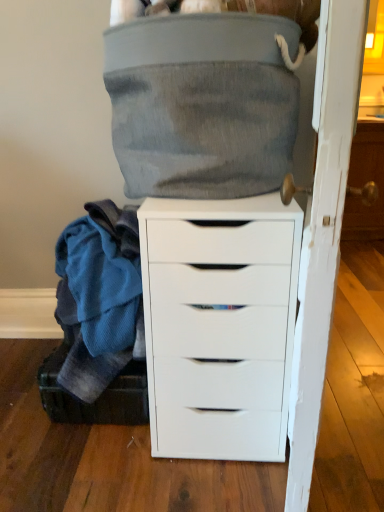
Question: From a real-world perspective, is white matte chest of drawers at center physically above black fabric shoe box at lower left?

Choices:
 (A) no
 (B) yes

Answer: (B)

Question: From the image's perspective, is white matte chest of drawers at center on black fabric shoe box at lower left?

Choices:
 (A) yes
 (B) no

Answer: (A)

Question: Is white matte chest of drawers at center turned away from black fabric shoe box at lower left?

Choices:
 (A) no
 (B) yes

Answer: (A)

Question: Is white matte chest of drawers at center positioned beyond the bounds of black fabric shoe box at lower left?

Choices:
 (A) yes
 (B) no

Answer: (A)

Question: From the image's perspective, is white matte chest of drawers at center located beneath black fabric shoe box at lower left?

Choices:
 (A) yes
 (B) no

Answer: (B)

Question: From the image's perspective, is white wood door at right above or below black fabric shoe box at lower left?

Choices:
 (A) below
 (B) above

Answer: (B)

Question: From their relative heights in the image, would you say white wood door at right is taller or shorter than black fabric shoe box at lower left?

Choices:
 (A) short
 (B) tall

Answer: (B)

Question: Based on their positions, is white wood door at right located to the left or right of black fabric shoe box at lower left?

Choices:
 (A) right
 (B) left

Answer: (A)

Question: In terms of size, does white wood door at right appear bigger or smaller than black fabric shoe box at lower left?

Choices:
 (A) small
 (B) big

Answer: (B)

Question: From their relative heights in the image, would you say white matte chest of drawers at center is taller or shorter than black fabric shoe box at lower left?

Choices:
 (A) short
 (B) tall

Answer: (B)

Question: In the image, is white matte chest of drawers at center on the left side or the right side of black fabric shoe box at lower left?

Choices:
 (A) left
 (B) right

Answer: (B)

Question: Is white matte chest of drawers at center in front of or behind black fabric shoe box at lower left in the image?

Choices:
 (A) behind
 (B) front

Answer: (B)

Question: From a real-world perspective, is white matte chest of drawers at center positioned above or below black fabric shoe box at lower left?

Choices:
 (A) above
 (B) below

Answer: (A)

Question: From a real-world perspective, relative to white wood door at right, is black fabric shoe box at lower left vertically above or below?

Choices:
 (A) below
 (B) above

Answer: (A)

Question: In terms of size, does black fabric shoe box at lower left appear bigger or smaller than white wood door at right?

Choices:
 (A) small
 (B) big

Answer: (A)